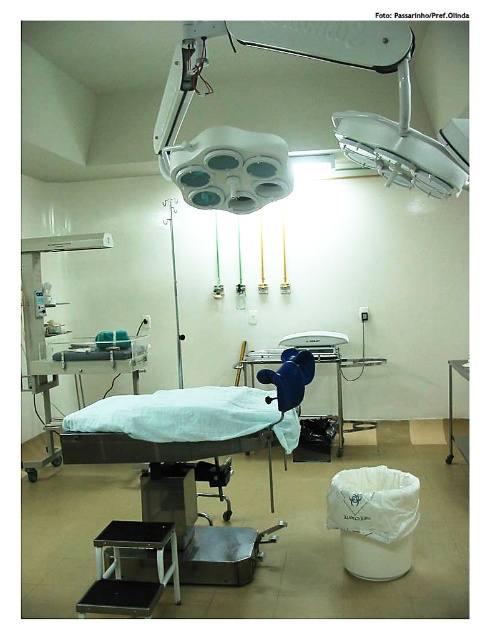
You are a medical student observing an operation from the back of the operating room. The white matte surgical light at upper center is in your line of sight. If you want to avoid looking directly at the light, which direction should you move? Please choose between left, right, forward, or backward.

The white matte surgical light at upper center is 1.44 meters from the camera. To avoid looking directly at it, you should move backward, as moving backward would increase the distance between you and the light, reducing its intensity in your field of view.

You are a nurse in an operating room. You need to move a medical kit from the blue plastic chair at center to the white plastic trash can at lower right. Can you do this without moving more than 4 feet?

The blue plastic chair at center and white plastic trash can at lower right are 3.73 feet apart, so yes, the nurse can move the medical kit without exceeding the 4 feet distance.